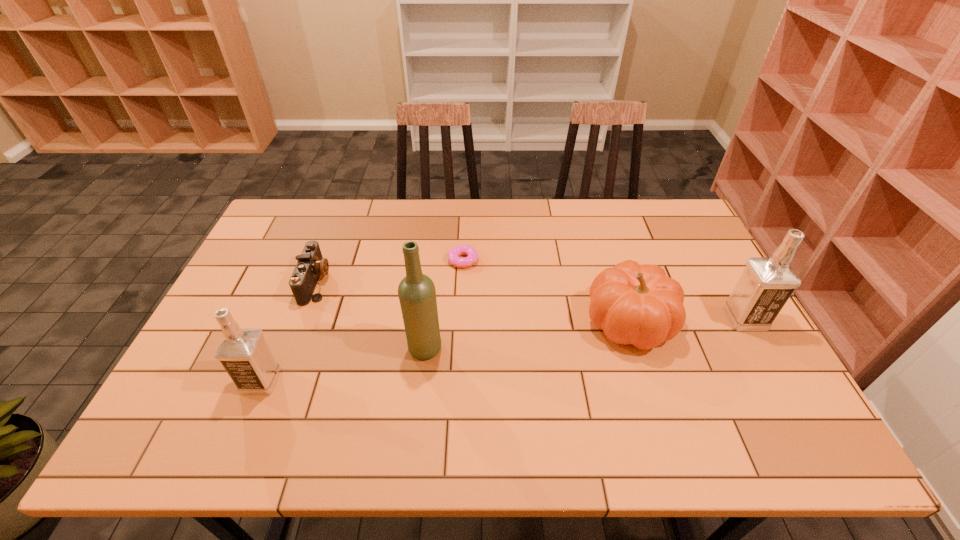
Find the location of a particular element. The image size is (960, 540). vacant area at the left edge is located at coordinates (259, 323).

At what (x,y) coordinates should I click in order to perform the action: click on free region at the right edge of the desktop. Please return your answer as a coordinate pair (x, y). Looking at the image, I should click on (676, 255).

Locate an element on the screen. This screenshot has width=960, height=540. vacant region between the camera and the rightmost object is located at coordinates (531, 300).

Where is `vacant area that lies between the right vodka and the second object from right to left`? vacant area that lies between the right vodka and the second object from right to left is located at coordinates (687, 320).

Where is `vacant space that's between the camera and the wine bottle`? This screenshot has width=960, height=540. vacant space that's between the camera and the wine bottle is located at coordinates (371, 315).

Image resolution: width=960 pixels, height=540 pixels. What are the coordinates of `vacant area between the wine bottle and the shortest object` in the screenshot? It's located at (444, 304).

Where is `vacant point located between the wine bottle and the doughnut`? The width and height of the screenshot is (960, 540). vacant point located between the wine bottle and the doughnut is located at coordinates point(444,304).

Where is `free space that is in between the third shortest object and the second shortest object`? free space that is in between the third shortest object and the second shortest object is located at coordinates (473, 302).

In order to click on free space between the shortest object and the third shortest object in this screenshot , I will do pyautogui.click(x=546, y=291).

What are the coordinates of `blank region between the left vodka and the wine bottle` in the screenshot? It's located at (343, 364).